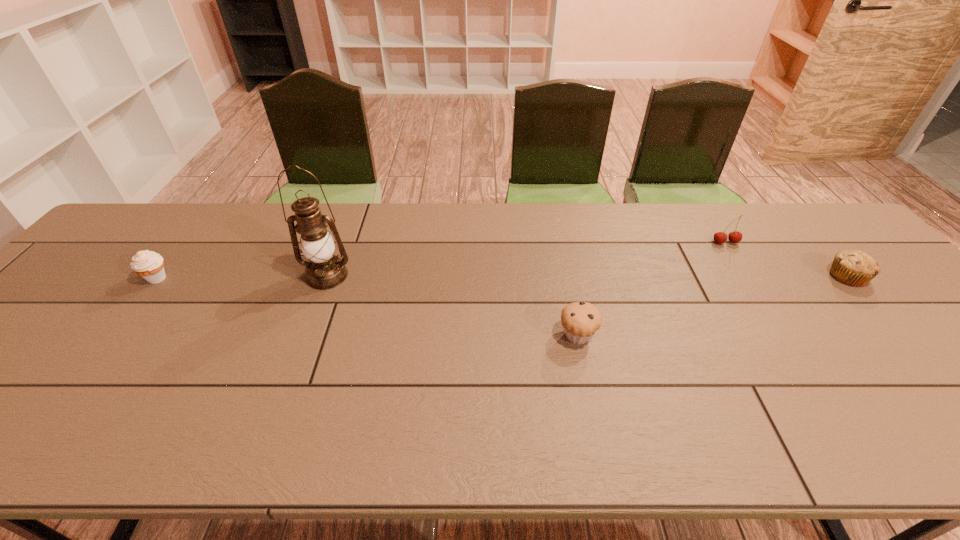
At what (x,y) coordinates should I click in order to perform the action: click on the tallest object. Please return your answer as a coordinate pair (x, y). Image resolution: width=960 pixels, height=540 pixels. Looking at the image, I should click on (325, 271).

The width and height of the screenshot is (960, 540). Find the location of `the fourth object from right to left`. the fourth object from right to left is located at coordinates (325, 271).

Image resolution: width=960 pixels, height=540 pixels. I want to click on cherry, so click(x=720, y=237).

This screenshot has width=960, height=540. Identify the location of the second object from right to left. (720, 237).

Locate an element on the screen. the leftmost object is located at coordinates (148, 264).

Locate an element on the screen. This screenshot has width=960, height=540. the nearest muffin is located at coordinates (580, 320).

Find the location of a particular element. The height and width of the screenshot is (540, 960). the third object from right to left is located at coordinates (580, 320).

Image resolution: width=960 pixels, height=540 pixels. I want to click on the rightmost muffin, so click(x=855, y=268).

Find the location of a particular element. Image resolution: width=960 pixels, height=540 pixels. vacant space situated 0.330m on the left of the second object from left to right is located at coordinates (180, 276).

You are a GUI agent. You are given a task and a screenshot of the screen. Output one action in this format:
    pyautogui.click(x=<x>, y=<y>)
    Task: Click on the free space located on the surface of the farthest object
    The image size is (960, 540).
    Given the screenshot: What is the action you would take?
    pyautogui.click(x=777, y=321)